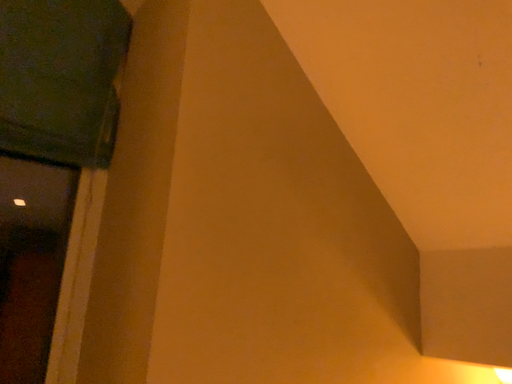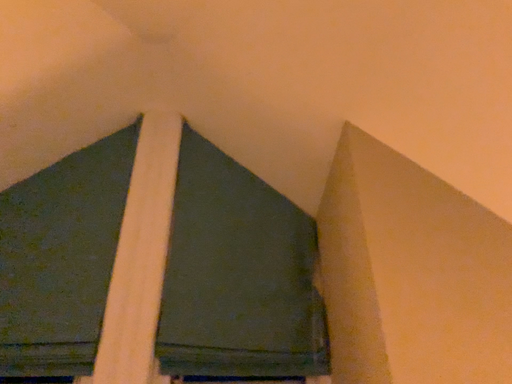
Question: Which way did the camera rotate in the video?

Choices:
 (A) rotated right
 (B) rotated left

Answer: (B)